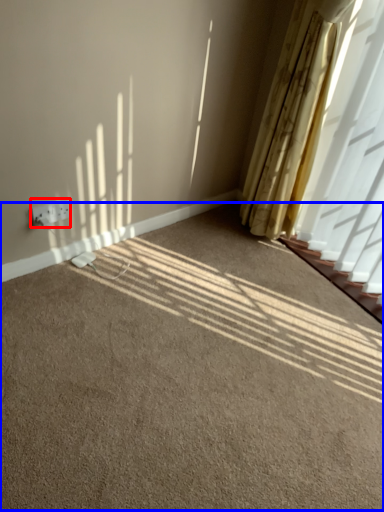
Question: Among these objects, which one is nearest to the camera, electric outlet (highlighted by a red box) or plain (highlighted by a blue box)?

Choices:
 (A) electric outlet
 (B) plain

Answer: (B)